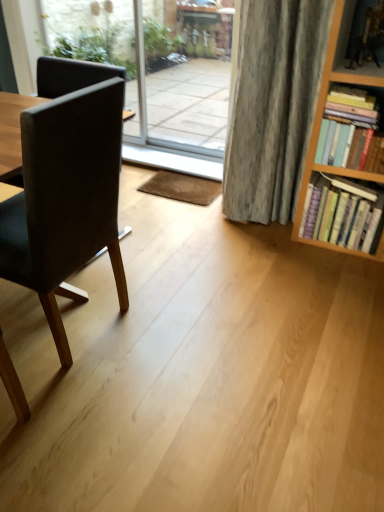
The image size is (384, 512). Identify the location of free spot to the right of matte black chair at left. (172, 327).